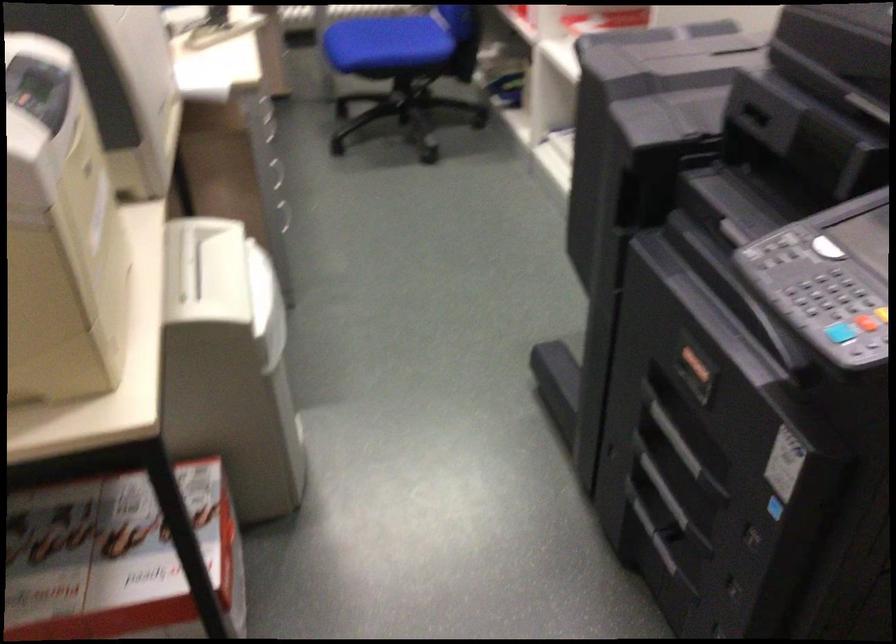
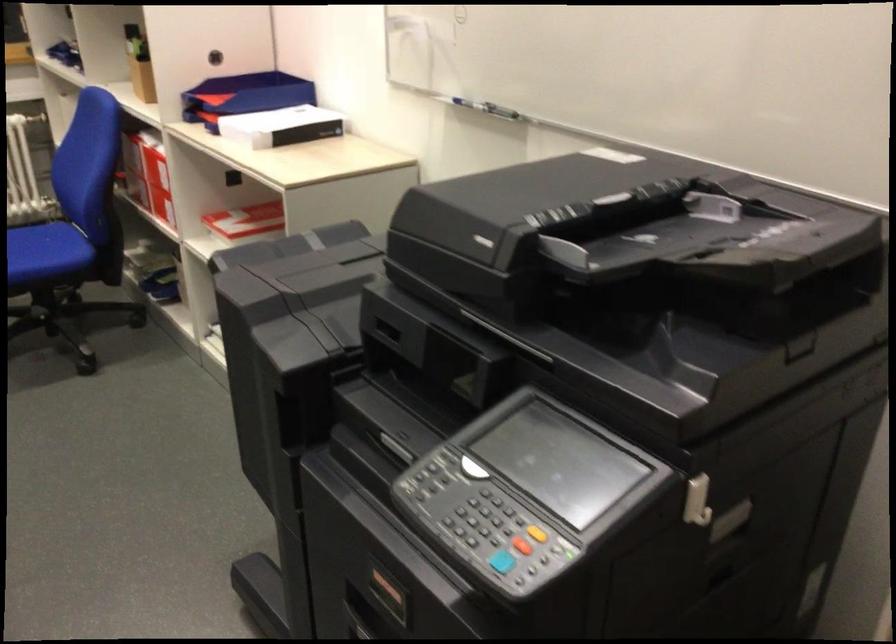
Question: The first image is from the beginning of the video and the second image is from the end. How did the camera likely rotate when shooting the video?

Choices:
 (A) Left
 (B) Right
 (C) Up
 (D) Down

Answer: (B)